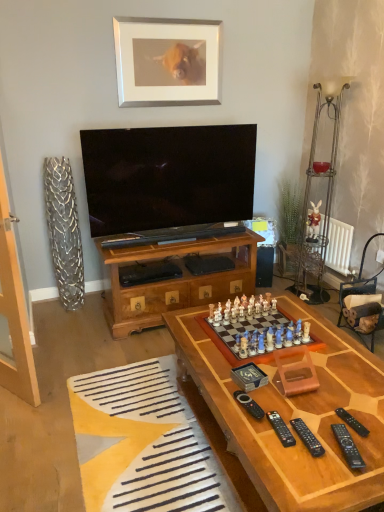
Where is `vacant location behind black plastic remote at lower right, the first remote when ordered from right to left`? vacant location behind black plastic remote at lower right, the first remote when ordered from right to left is located at coordinates (334, 393).